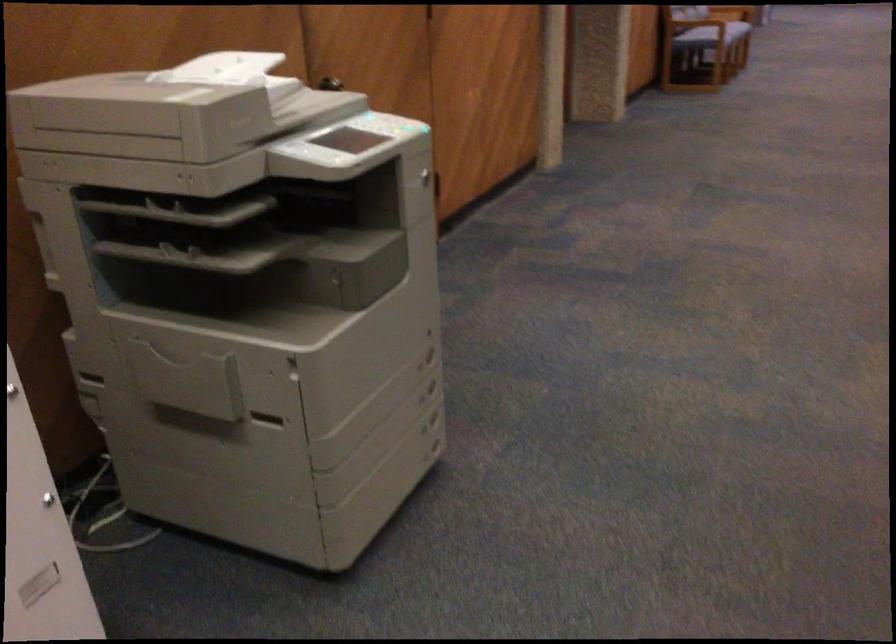
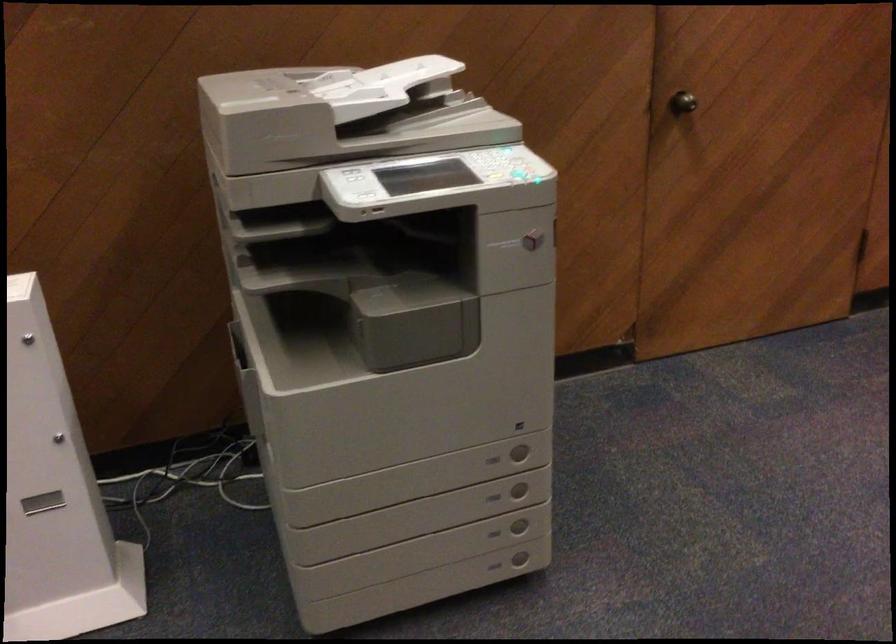
The point at (211, 79) is marked in the first image. Where is the corresponding point in the second image?

(376, 86)